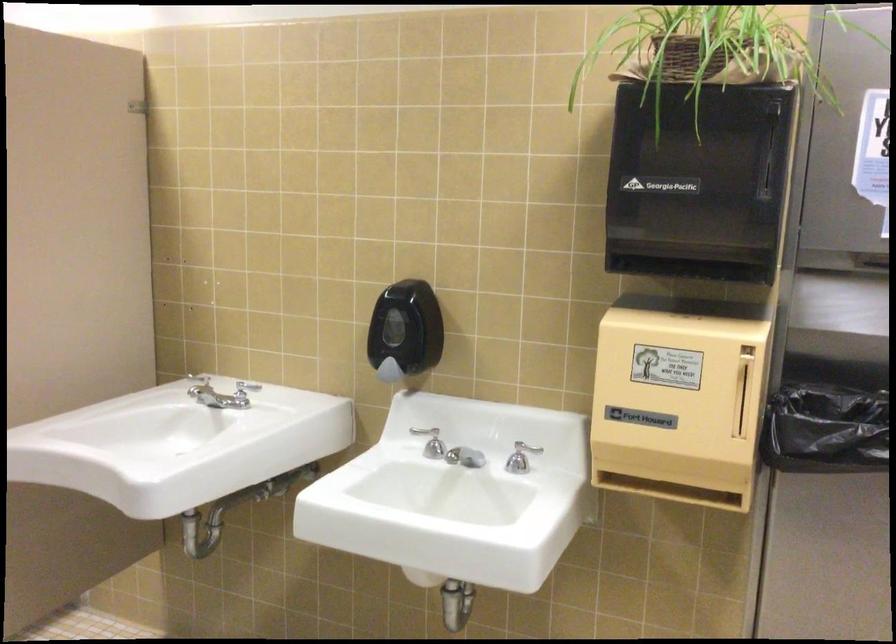
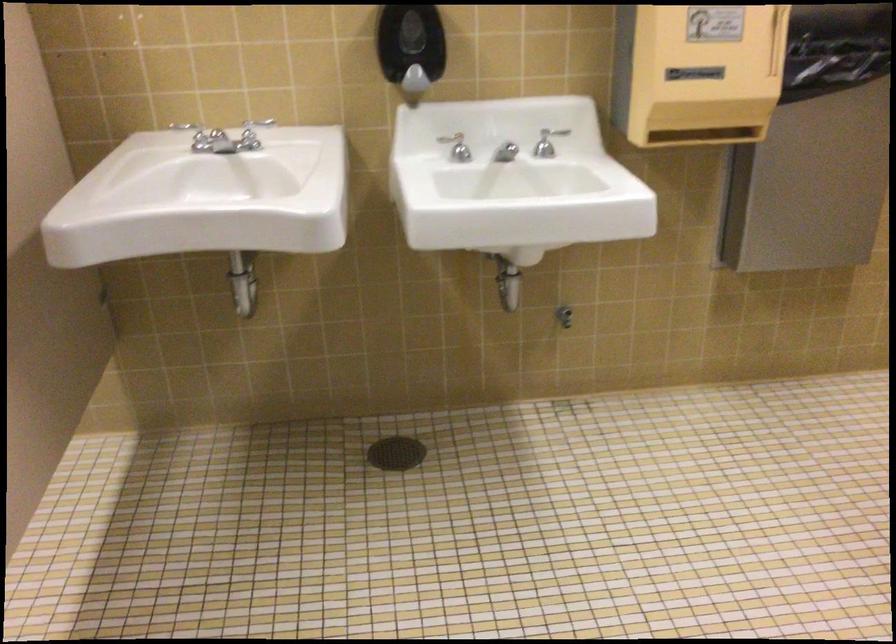
Find the pixel in the second image that matches [444,439] in the first image.

(457, 147)